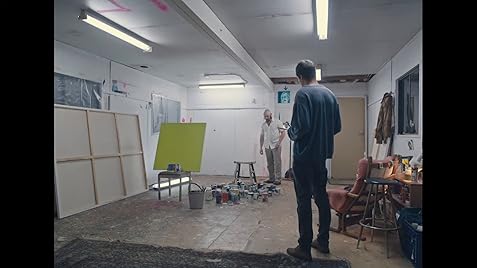
Identify the location of wall. [x=84, y=68], [x=234, y=132], [x=403, y=60].